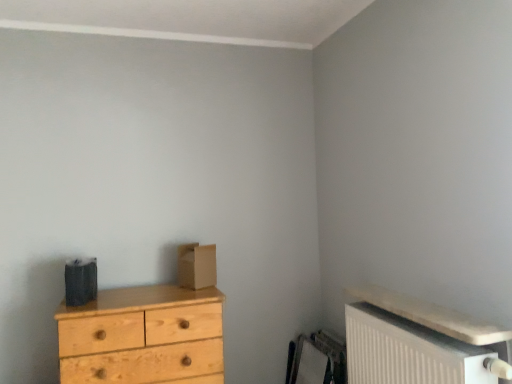
What is the approximate width of white textured radiator at lower right?

white textured radiator at lower right is 7.36 inches in width.

This screenshot has height=384, width=512. I want to click on natural wood chest of drawers at left, so [141, 335].

Considering the relative sizes of natural wood chest of drawers at left and white textured radiator at lower right in the image provided, is natural wood chest of drawers at left wider than white textured radiator at lower right?

Indeed, natural wood chest of drawers at left has a greater width compared to white textured radiator at lower right.

Could you tell me if natural wood chest of drawers at left is facing white textured radiator at lower right?

No, natural wood chest of drawers at left is not facing towards white textured radiator at lower right.

Is white textured radiator at lower right surrounded by natural wood chest of drawers at left?

No, white textured radiator at lower right is not a part of natural wood chest of drawers at left.

Between natural wood chest of drawers at left and white textured radiator at lower right, which one has smaller size?

white textured radiator at lower right is smaller.

From the image's perspective, would you say brown cardboard box at center is positioned over white textured radiator at lower right?

Yes, from the image's perspective, brown cardboard box at center is above white textured radiator at lower right.

Is point (199, 257) closer or farther from the camera than point (368, 335)?

Point (199, 257) is farther from the camera than point (368, 335).

Considering the relative sizes of brown cardboard box at center and white textured radiator at lower right in the image provided, is brown cardboard box at center bigger than white textured radiator at lower right?

No, brown cardboard box at center is not bigger than white textured radiator at lower right.

Considering the relative sizes of brown cardboard box at center and white textured radiator at lower right in the image provided, is brown cardboard box at center taller than white textured radiator at lower right?

No, brown cardboard box at center is not taller than white textured radiator at lower right.

From a real-world perspective, who is located higher, white textured radiator at lower right or brown cardboard box at center?

In real-world perspective, brown cardboard box at center is above.

Considering the relative sizes of white textured radiator at lower right and brown cardboard box at center in the image provided, is white textured radiator at lower right shorter than brown cardboard box at center?

Incorrect, the height of white textured radiator at lower right does not fall short of that of brown cardboard box at center.

Could you tell me if white textured radiator at lower right is facing brown cardboard box at center?

No, white textured radiator at lower right is not aimed at brown cardboard box at center.

Between point (350, 372) and point (188, 264), which one is positioned behind?

The point (188, 264) is more distant.

Does brown cardboard box at center have a greater width compared to natural wood chest of drawers at left?

In fact, brown cardboard box at center might be narrower than natural wood chest of drawers at left.

Does point (192, 247) come farther from viewer compared to point (115, 374)?

Yes, point (192, 247) is behind point (115, 374).

Find the location of a particular element. The height and width of the screenshot is (384, 512). chest of drawers to the left of brown cardboard box at center is located at coordinates click(141, 335).

Which is in front, brown cardboard box at center or natural wood chest of drawers at left?

natural wood chest of drawers at left is more forward.

Is the surface of natural wood chest of drawers at left in direct contact with brown cardboard box at center?

natural wood chest of drawers at left and brown cardboard box at center are clearly separated.

In the scene shown: Between natural wood chest of drawers at left and brown cardboard box at center, which one has less height?

Standing shorter between the two is brown cardboard box at center.

Which object is further away from the camera taking this photo, natural wood chest of drawers at left or brown cardboard box at center?

Positioned behind is brown cardboard box at center.

The image size is (512, 384). I want to click on radiator on the right side of natural wood chest of drawers at left, so click(x=408, y=352).

From the picture: Are white textured radiator at lower right and natural wood chest of drawers at left located far from each other?

That's not correct — white textured radiator at lower right is a little close to natural wood chest of drawers at left.

Does point (359, 378) come in front of point (67, 325)?

No, (359, 378) is further to viewer.

Locate an element on the screen. the chest of drawers lying below the white textured radiator at lower right (from the image's perspective) is located at coordinates (141, 335).

Find the location of a particular element. The width and height of the screenshot is (512, 384). cardboard box behind the white textured radiator at lower right is located at coordinates (197, 266).

When comparing their distances from brown cardboard box at center, does white textured radiator at lower right or natural wood chest of drawers at left seem closer?

natural wood chest of drawers at left lies closer to brown cardboard box at center than the other object.

Looking at the image, which one is located further to brown cardboard box at center, natural wood chest of drawers at left or white textured radiator at lower right?

Based on the image, white textured radiator at lower right appears to be further to brown cardboard box at center.

From the image, which object appears to be farther from natural wood chest of drawers at left, white textured radiator at lower right or brown cardboard box at center?

white textured radiator at lower right is positioned further to the anchor natural wood chest of drawers at left.

Looking at the image, which one is located further to white textured radiator at lower right, brown cardboard box at center or natural wood chest of drawers at left?

The object further to white textured radiator at lower right is brown cardboard box at center.

Looking at the image, which one is located closer to white textured radiator at lower right, natural wood chest of drawers at left or brown cardboard box at center?

Among the two, natural wood chest of drawers at left is located nearer to white textured radiator at lower right.

From the image, which object appears to be nearer to natural wood chest of drawers at left, brown cardboard box at center or white textured radiator at lower right?

brown cardboard box at center lies closer to natural wood chest of drawers at left than the other object.

Locate an element on the screen. cardboard box between natural wood chest of drawers at left and white textured radiator at lower right from left to right is located at coordinates (197, 266).